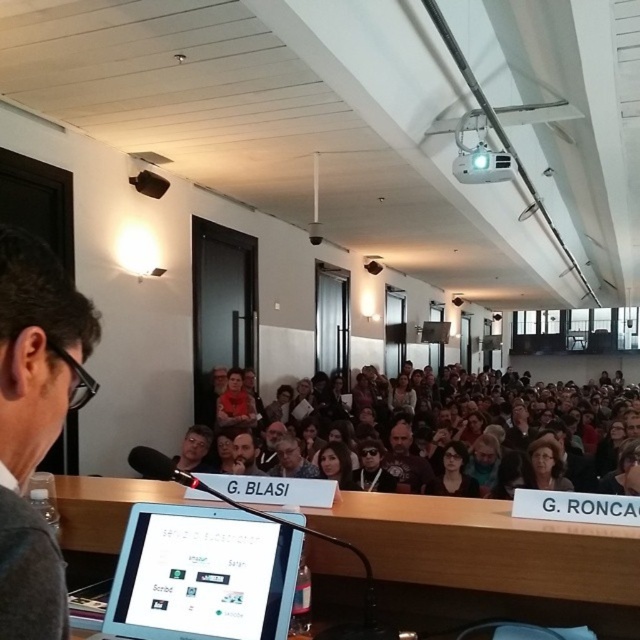
Consider the image. Which is more to the left, silver metallic tablet at center or dark brown hair at center?

From the viewer's perspective, silver metallic tablet at center appears more on the left side.

Can you confirm if silver metallic tablet at center is shorter than dark brown hair at center?

Correct, silver metallic tablet at center is not as tall as dark brown hair at center.

Identify the location of silver metallic tablet at center. 202,576.

Can you confirm if silver metallic tablet at center is positioned to the right of matte black hair at center?

Incorrect, silver metallic tablet at center is not on the right side of matte black hair at center.

Does silver metallic tablet at center have a lesser width compared to matte black hair at center?

In fact, silver metallic tablet at center might be wider than matte black hair at center.

Between point (220, 556) and point (316, 458), which one is positioned behind?

Point (316, 458)

The image size is (640, 640). I want to click on silver metallic tablet at center, so click(x=202, y=576).

Can you confirm if black matte glasses at left is smaller than dark brown hair at center?

Yes.

Between black matte glasses at left and dark brown hair at center, which one appears on the left side from the viewer's perspective?

black matte glasses at left is more to the left.

I want to click on black matte glasses at left, so (38, 349).